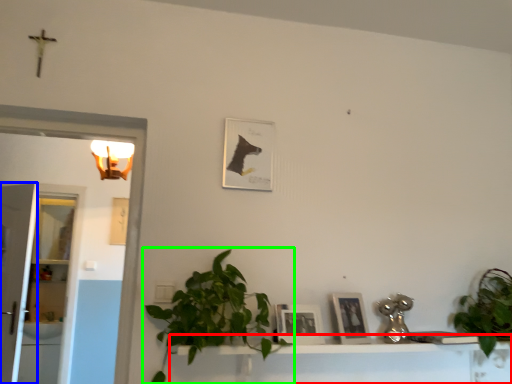
Question: Which object is the farthest from vanity (highlighted by a red box)? Choose among these: glass door (highlighted by a blue box) or houseplant (highlighted by a green box).

Choices:
 (A) glass door
 (B) houseplant

Answer: (A)